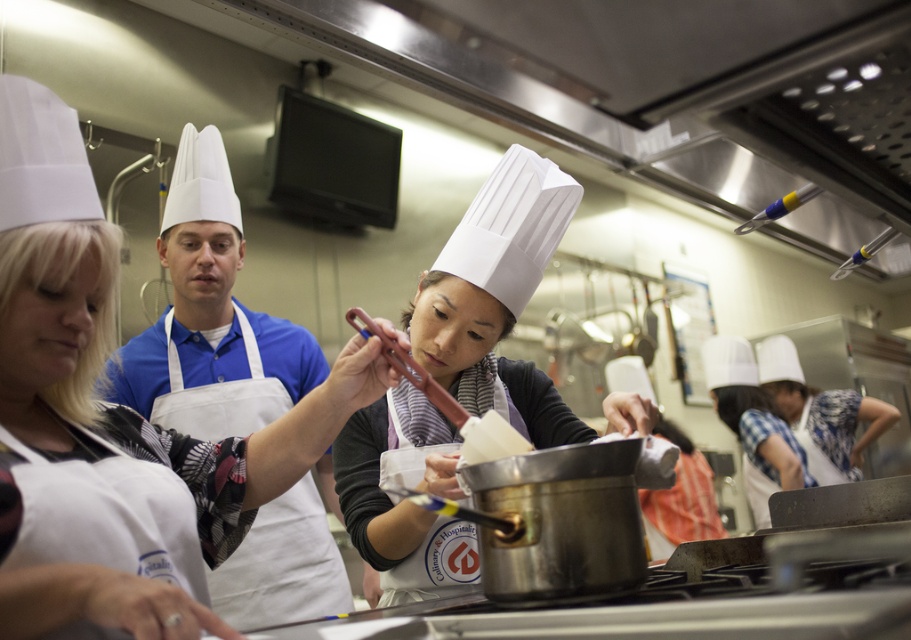
Question: Is white matte chef hat at upper left above white cotton apron at center?

Choices:
 (A) no
 (B) yes

Answer: (B)

Question: Among these objects, which one is nearest to the camera?

Choices:
 (A) white matte chef hat at center
 (B) white chef hat at center
 (C) white cotton apron at center
 (D) white matte chef hat at upper left

Answer: (D)

Question: Does white matte chef hat at center appear over white chef hat at center?

Choices:
 (A) yes
 (B) no

Answer: (A)

Question: Is white matte chef hat at center to the left of white cotton apron at center from the viewer's perspective?

Choices:
 (A) no
 (B) yes

Answer: (A)

Question: Which point is farther from the camera taking this photo?

Choices:
 (A) (449, 372)
 (B) (216, 468)
 (C) (778, 433)

Answer: (C)

Question: Which point is closer to the camera taking this photo?

Choices:
 (A) (715, 412)
 (B) (480, 292)

Answer: (B)